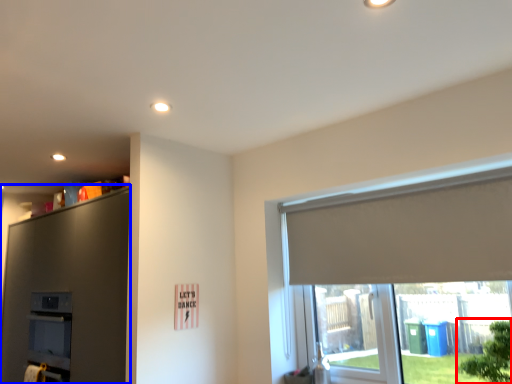
Question: Which object is further to the camera taking this photo, tree (highlighted by a red box) or dresser (highlighted by a blue box)?

Choices:
 (A) tree
 (B) dresser

Answer: (B)